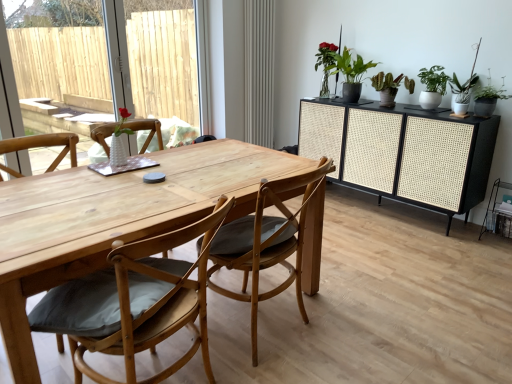
Where is `free area below green matte plant at upper right, which is the third houseplant from left to right (from a real-world perspective)`? The width and height of the screenshot is (512, 384). free area below green matte plant at upper right, which is the third houseplant from left to right (from a real-world perspective) is located at coordinates (430, 104).